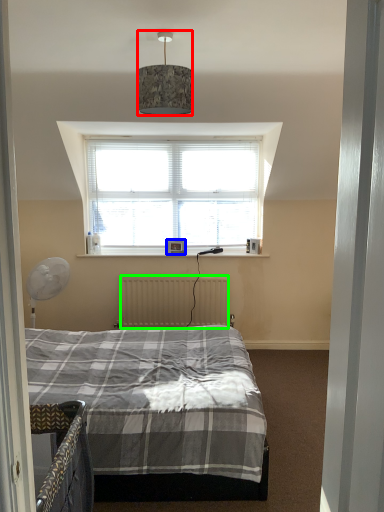
Question: Which object is the farthest from lamp (highlighted by a red box)? Choose among these: picture frame (highlighted by a blue box) or radiator (highlighted by a green box).

Choices:
 (A) picture frame
 (B) radiator

Answer: (B)